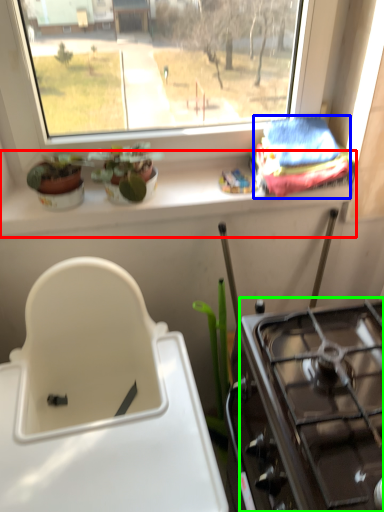
Question: Considering the real-world distances, which object is farthest from window sill (highlighted by a red box)? material (highlighted by a blue box) or gas stove (highlighted by a green box)?

Choices:
 (A) material
 (B) gas stove

Answer: (B)